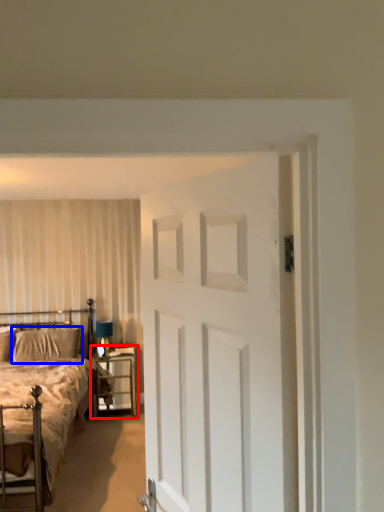
Question: Which object is closer to the camera taking this photo, nightstand (highlighted by a red box) or pillow (highlighted by a blue box)?

Choices:
 (A) nightstand
 (B) pillow

Answer: (A)